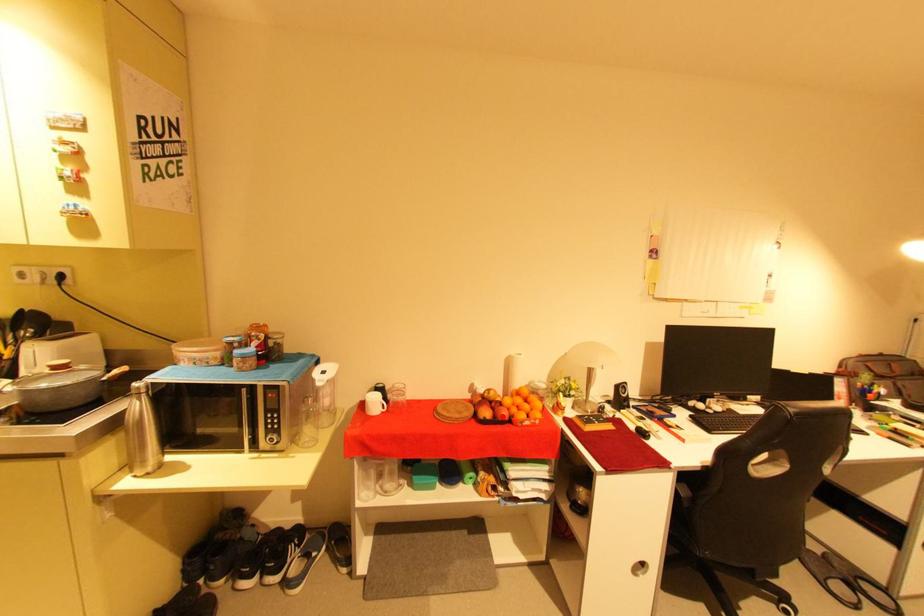
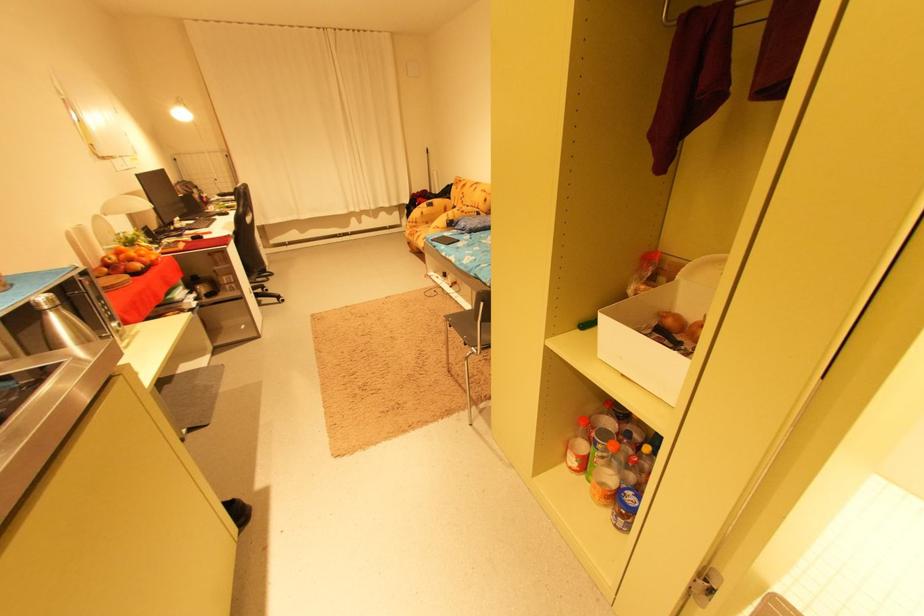
Locate, in the second image, the point that corresponds to the highlighted location in the first image.

(151, 265)